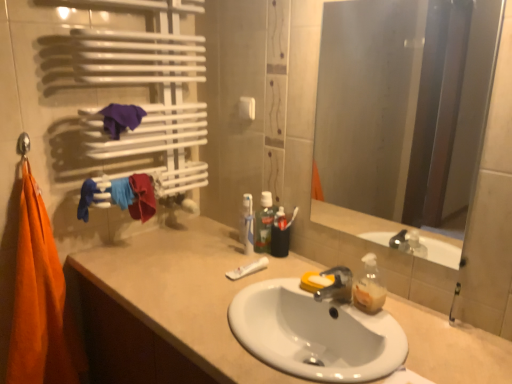
Find the location of a particular element. free space in front of green translucent mouthwash at center is located at coordinates (268, 273).